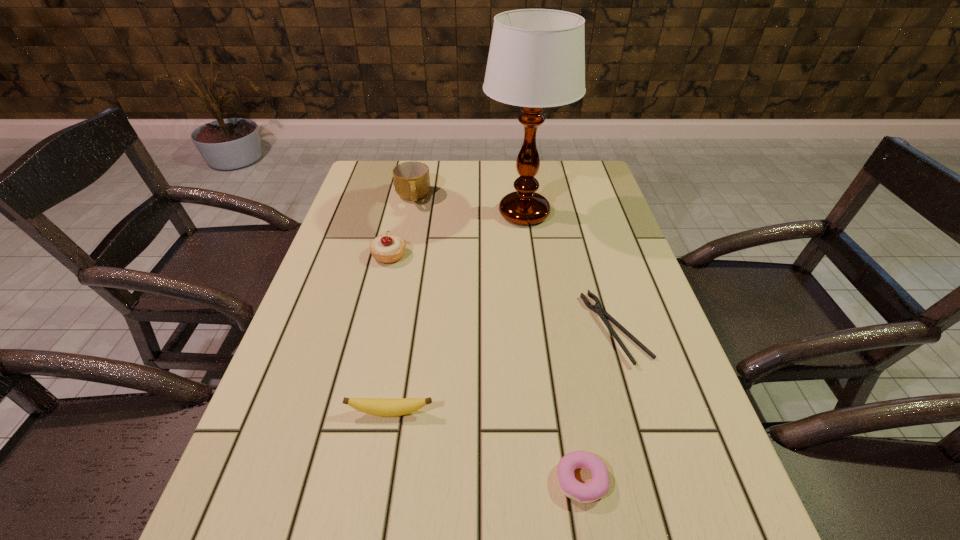
The height and width of the screenshot is (540, 960). What are the coordinates of `banana that is at the left edge` in the screenshot? It's located at (381, 407).

Identify the location of table lamp present at the right edge. (536, 59).

I want to click on tongs that is positioned at the right edge, so click(x=597, y=308).

At what (x,y) coordinates should I click in order to perform the action: click on object that is at the far left corner. Please return your answer as a coordinate pair (x, y). The width and height of the screenshot is (960, 540). Looking at the image, I should click on (411, 179).

Locate an element on the screen. The height and width of the screenshot is (540, 960). object located at the far right corner is located at coordinates (536, 59).

Locate an element on the screen. blank space at the far edge is located at coordinates (487, 165).

Where is `free space at the left edge`? free space at the left edge is located at coordinates (352, 265).

Find the location of a particular element. The image size is (960, 540). free point at the right edge is located at coordinates (641, 369).

This screenshot has width=960, height=540. In the image, there is a desktop. What are the coordinates of `free region at the far left corner` in the screenshot? It's located at pyautogui.click(x=381, y=171).

Locate an element on the screen. free location at the far right corner of the desktop is located at coordinates (577, 171).